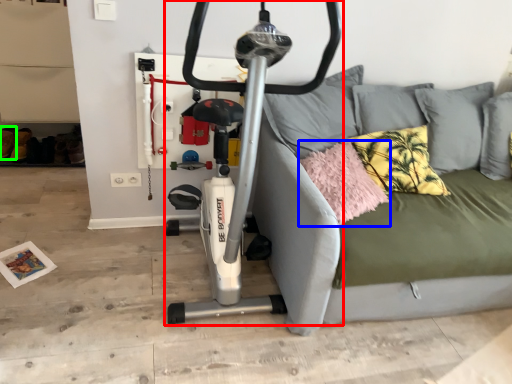
Question: Considering the real-world distances, which object is farthest from stationary bicycle (highlighted by a red box)? pillow (highlighted by a blue box) or shoe (highlighted by a green box)?

Choices:
 (A) pillow
 (B) shoe

Answer: (B)